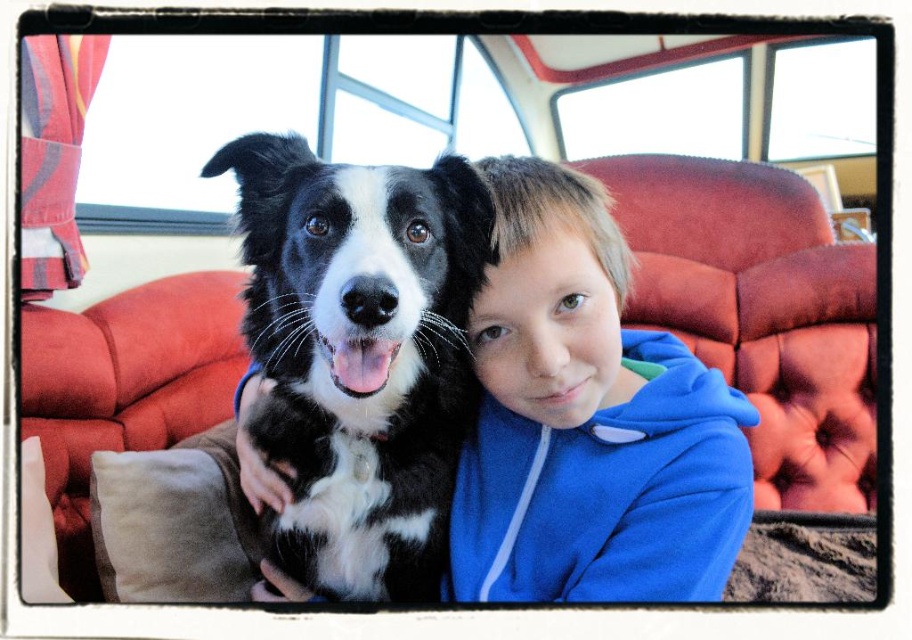
Looking at this image, is blue fleece jacket at center taller than black and white fur at center?

Indeed, blue fleece jacket at center has a greater height compared to black and white fur at center.

Is the position of blue fleece jacket at center less distant than that of black and white fur at center?

No, blue fleece jacket at center is behind black and white fur at center.

Which is in front, point (547, 198) or point (326, 554)?

Positioned in front is point (547, 198).

Find the location of a particular element. blue fleece jacket at center is located at coordinates (588, 420).